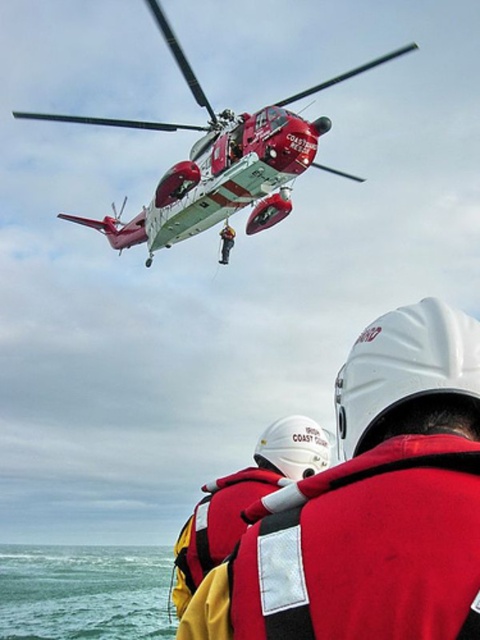
Question: Does green water at lower left appear on the right side of red life vest at lower center?

Choices:
 (A) yes
 (B) no

Answer: (B)

Question: Is green water at lower left above red life vest at lower center?

Choices:
 (A) yes
 (B) no

Answer: (B)

Question: Can you confirm if green water at lower left is positioned below matte white helmet at upper center?

Choices:
 (A) yes
 (B) no

Answer: (A)

Question: Which point is closer to the camera?

Choices:
 (A) (215, 486)
 (B) (219, 250)
 (C) (148, 262)
 (D) (24, 568)

Answer: (A)

Question: Which point is farther to the camera?

Choices:
 (A) (182, 614)
 (B) (288, 477)
 (C) (130, 128)

Answer: (C)

Question: Which point appears closest to the camera in this image?

Choices:
 (A) (154, 604)
 (B) (432, 452)

Answer: (B)